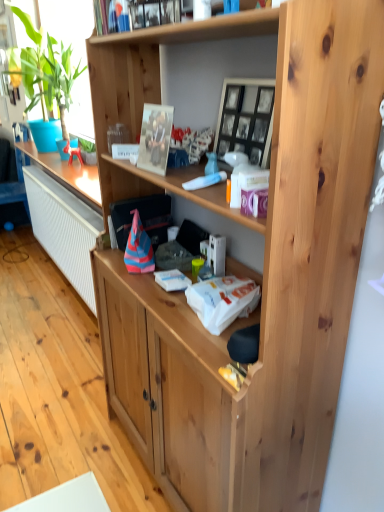
Question: Can you confirm if black glass picture frame at upper center, which ranks as the second picture frame in left-to-right order, is wider than green leafy plant at left?

Choices:
 (A) no
 (B) yes

Answer: (A)

Question: Can you confirm if black glass picture frame at upper center, which is the 1th picture frame from right to left, is taller than green leafy plant at left?

Choices:
 (A) yes
 (B) no

Answer: (B)

Question: Does black glass picture frame at upper center, which ranks as the second picture frame in left-to-right order, appear on the left side of green leafy plant at left?

Choices:
 (A) no
 (B) yes

Answer: (A)

Question: Can you see black glass picture frame at upper center, which is the 1th picture frame from right to left, touching green leafy plant at left?

Choices:
 (A) yes
 (B) no

Answer: (B)

Question: Would you say black glass picture frame at upper center, which ranks as the second picture frame in left-to-right order, contains green leafy plant at left?

Choices:
 (A) yes
 (B) no

Answer: (B)

Question: Is metallic silver photo frame at upper center to the left or to the right of green leafy plant at left in the image?

Choices:
 (A) right
 (B) left

Answer: (A)

Question: Choose the correct answer: Is metallic silver photo frame at upper center inside green leafy plant at left or outside it?

Choices:
 (A) outside
 (B) inside

Answer: (A)

Question: In terms of height, does metallic silver photo frame at upper center look taller or shorter compared to green leafy plant at left?

Choices:
 (A) short
 (B) tall

Answer: (A)

Question: From the image's perspective, is metallic silver photo frame at upper center positioned above or below green leafy plant at left?

Choices:
 (A) above
 (B) below

Answer: (B)

Question: Is point (97, 33) closer or farther from the camera than point (241, 148)?

Choices:
 (A) farther
 (B) closer

Answer: (A)

Question: From the image's perspective, is metallic silver photo frame at upper center positioned above or below black glass picture frame at upper center, which is the 1th picture frame from right to left?

Choices:
 (A) below
 (B) above

Answer: (B)

Question: In terms of height, does metallic silver photo frame at upper center look taller or shorter compared to black glass picture frame at upper center, which is the 1th picture frame from right to left?

Choices:
 (A) short
 (B) tall

Answer: (A)

Question: Looking at the image, does metallic silver photo frame at upper center seem bigger or smaller compared to black glass picture frame at upper center, which ranks as the second picture frame in left-to-right order?

Choices:
 (A) small
 (B) big

Answer: (A)

Question: From a real-world perspective, is metallic silver photo frame at upper center above or below metallic silver picture frame at upper center, the 2th picture frame in the right-to-left sequence?

Choices:
 (A) below
 (B) above

Answer: (B)

Question: Is metallic silver photo frame at upper center wider or thinner than metallic silver picture frame at upper center, the 1th picture frame in the left-to-right sequence?

Choices:
 (A) wide
 (B) thin

Answer: (A)